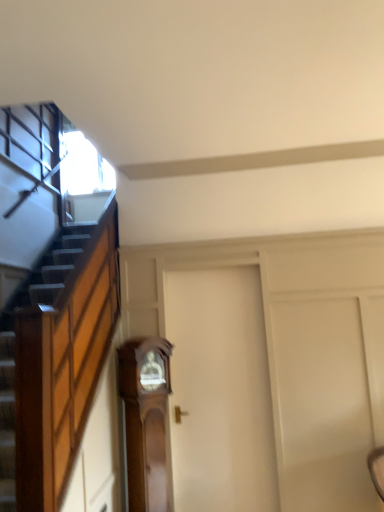
Question: Is wooden grandfather clock at center taller or shorter than white matte door at center?

Choices:
 (A) tall
 (B) short

Answer: (B)

Question: In terms of width, does wooden grandfather clock at center look wider or thinner when compared to white matte door at center?

Choices:
 (A) thin
 (B) wide

Answer: (B)

Question: In the image, is wooden grandfather clock at center positioned in front of or behind white matte door at center?

Choices:
 (A) front
 (B) behind

Answer: (A)

Question: Is white matte door at center inside the boundaries of wooden grandfather clock at center, or outside?

Choices:
 (A) inside
 (B) outside

Answer: (B)

Question: From the image's perspective, is white matte door at center positioned above or below wooden grandfather clock at center?

Choices:
 (A) below
 (B) above

Answer: (B)

Question: Considering the positions of white matte door at center and wooden grandfather clock at center in the image, is white matte door at center wider or thinner than wooden grandfather clock at center?

Choices:
 (A) wide
 (B) thin

Answer: (B)

Question: Considering the positions of white matte door at center and wooden grandfather clock at center in the image, is white matte door at center bigger or smaller than wooden grandfather clock at center?

Choices:
 (A) small
 (B) big

Answer: (B)